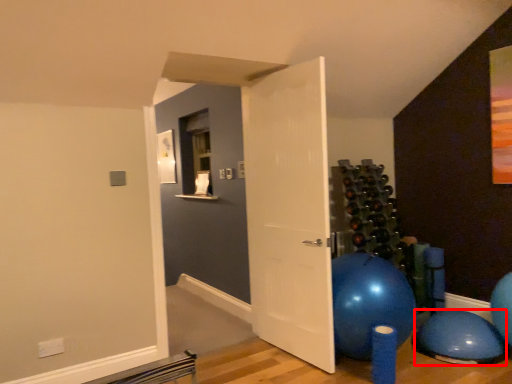
Question: From the image, what is the correct spatial relationship of balloon (annotated by the red box) in relation to door?

Choices:
 (A) right
 (B) left

Answer: (A)